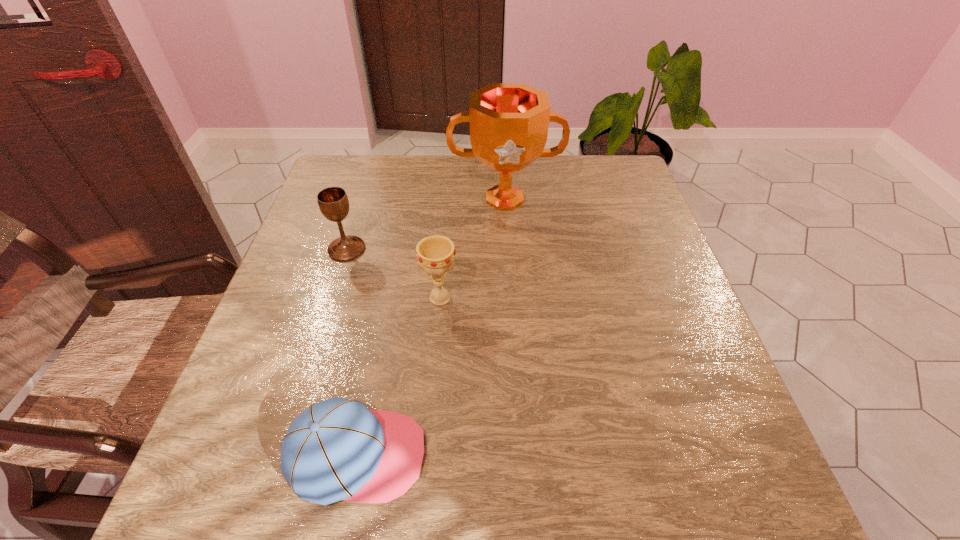
Identify the location of free space at the near left corner of the desktop. (203, 471).

In the image, there is a desktop. Identify the location of free space at the far right corner. The width and height of the screenshot is (960, 540). (582, 170).

I want to click on free space at the near right corner of the desktop, so click(x=754, y=516).

At what (x,y) coordinates should I click in order to perform the action: click on vacant area between the nearer chalice and the nearest object. Please return your answer as a coordinate pair (x, y). Looking at the image, I should click on 398,376.

The height and width of the screenshot is (540, 960). What are the coordinates of `vacant point located between the right chalice and the tallest object` in the screenshot? It's located at (472, 249).

I want to click on free spot between the second farthest object and the tallest object, so click(425, 224).

The width and height of the screenshot is (960, 540). I want to click on empty space that is in between the award and the nearest object, so click(x=431, y=327).

Find the location of a particular element. empty space between the third nearest object and the award is located at coordinates (425, 224).

The image size is (960, 540). Find the location of `empty space that is in between the second nearest object and the farther chalice`. empty space that is in between the second nearest object and the farther chalice is located at coordinates (394, 273).

Where is `vacant area that lies between the left chalice and the baseball cap`? The height and width of the screenshot is (540, 960). vacant area that lies between the left chalice and the baseball cap is located at coordinates (352, 352).